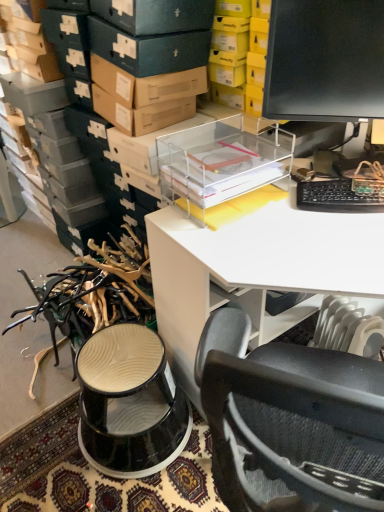
Find the location of a particular element. The width and height of the screenshot is (384, 512). free region on the left part of black plastic keyboard at right is located at coordinates coord(276,224).